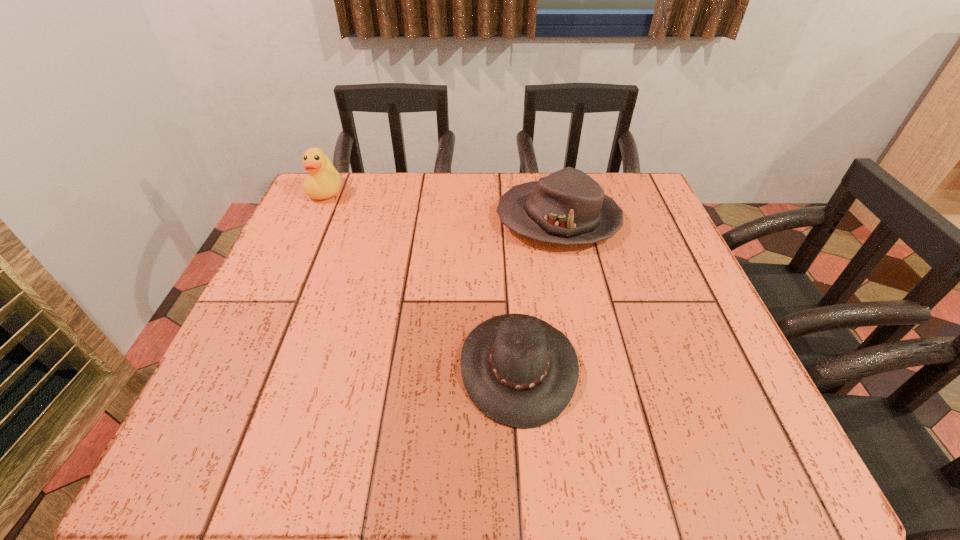
I want to click on the leftmost object, so click(x=323, y=182).

I want to click on the farther hat, so click(568, 207).

This screenshot has width=960, height=540. What are the coordinates of `the taller hat` in the screenshot? It's located at (568, 207).

You are a GUI agent. You are given a task and a screenshot of the screen. Output one action in this format:
    pyautogui.click(x=<x>, y=<y>)
    Task: Click on the shortest object
    This screenshot has width=960, height=540.
    Given the screenshot: What is the action you would take?
    pyautogui.click(x=520, y=371)

Identify the location of the shorter hat. Image resolution: width=960 pixels, height=540 pixels. (520, 371).

The height and width of the screenshot is (540, 960). Find the location of `free space located at the beak of the leftmost object`. free space located at the beak of the leftmost object is located at coordinates (289, 273).

At what (x,y) coordinates should I click in order to perform the action: click on free spot located 0.140m on the decorative side of the farther hat. Please return your answer as a coordinate pair (x, y). The height and width of the screenshot is (540, 960). Looking at the image, I should click on (440, 220).

Find the location of a particular element. The height and width of the screenshot is (540, 960). blank space located 0.190m on the decorative side of the farther hat is located at coordinates (420, 220).

The height and width of the screenshot is (540, 960). Find the location of `free space located on the decorative side of the farther hat`. free space located on the decorative side of the farther hat is located at coordinates (440, 220).

I want to click on free spot located 0.390m on the front-facing side of the nearest object, so click(x=244, y=366).